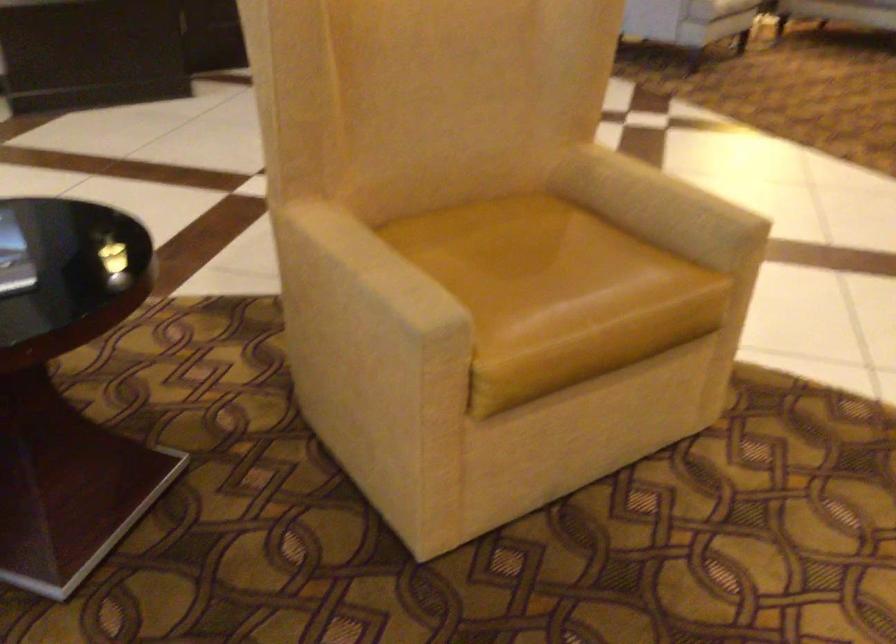
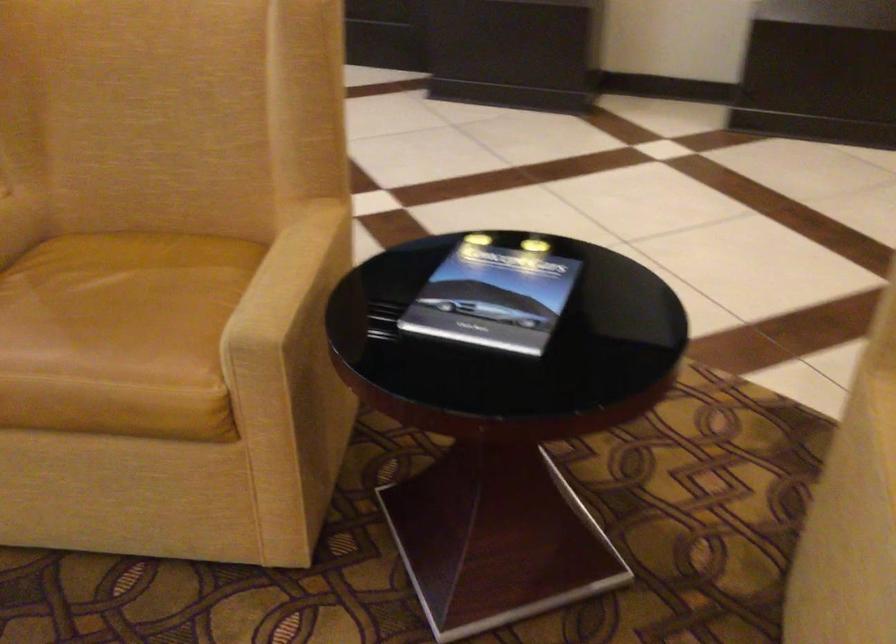
Question: Based on the continuous images, in which direction is the camera rotating? Reply with the corresponding letter.

Choices:
 (A) Left
 (B) Right
 (C) Up
 (D) Down

Answer: (A)